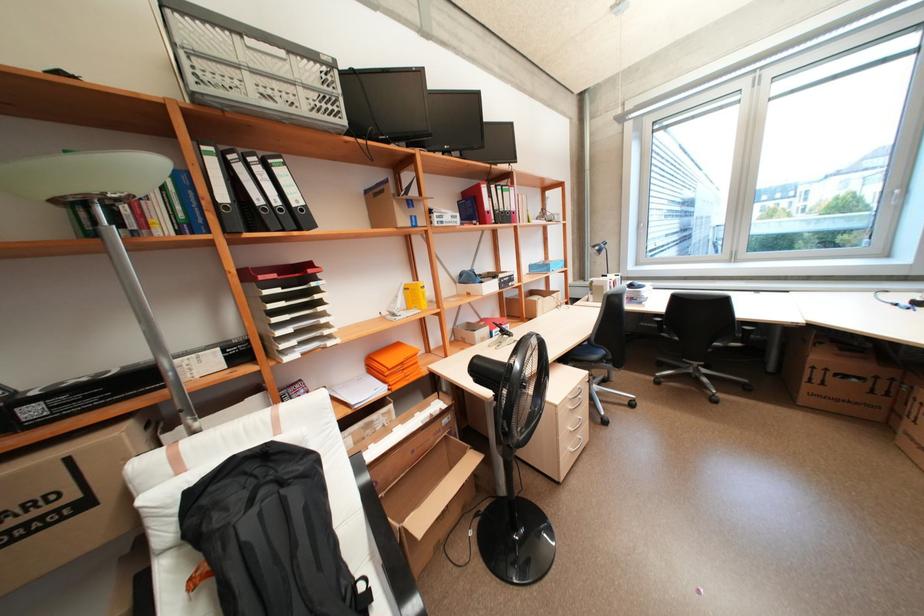
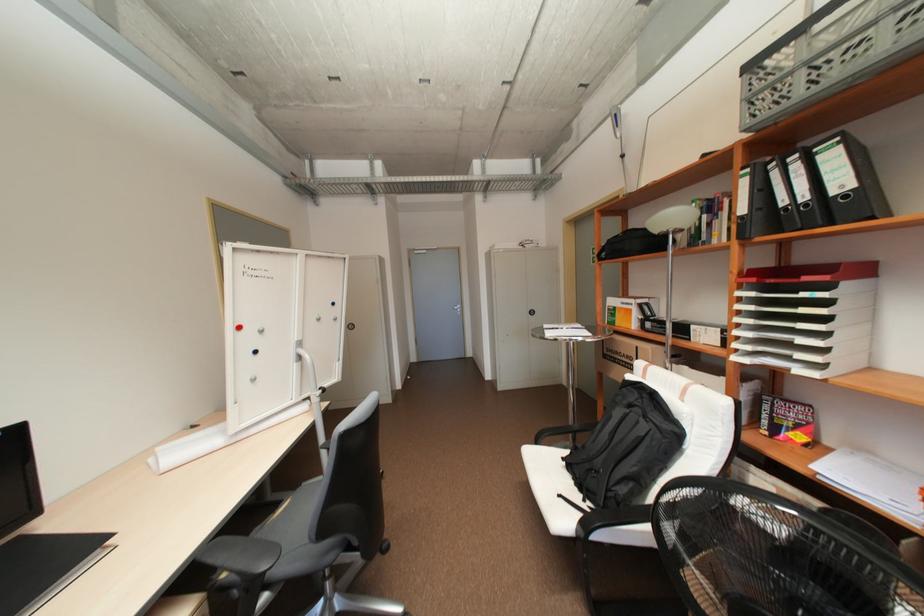
Find the pixel in the second image that matches point (283, 201) in the first image.

(810, 197)